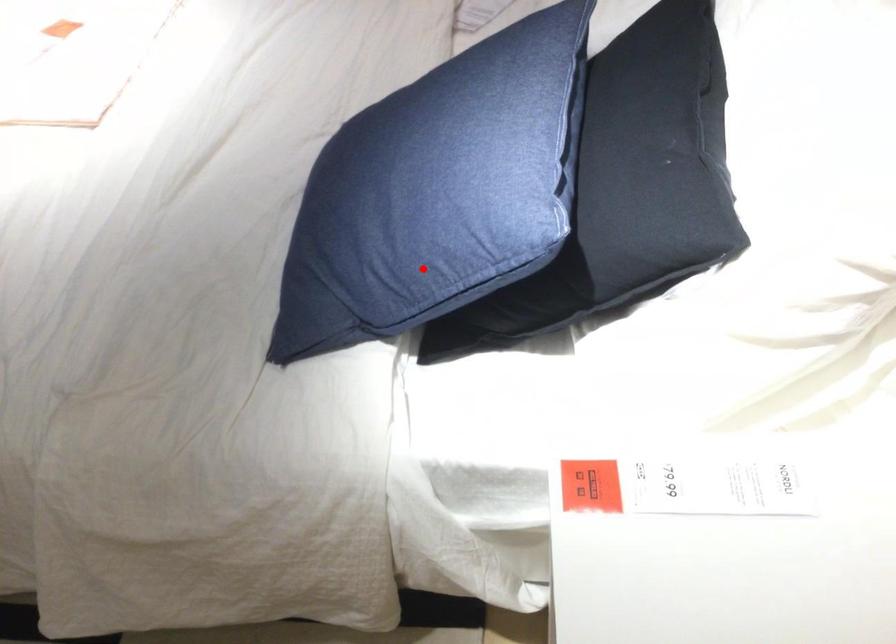
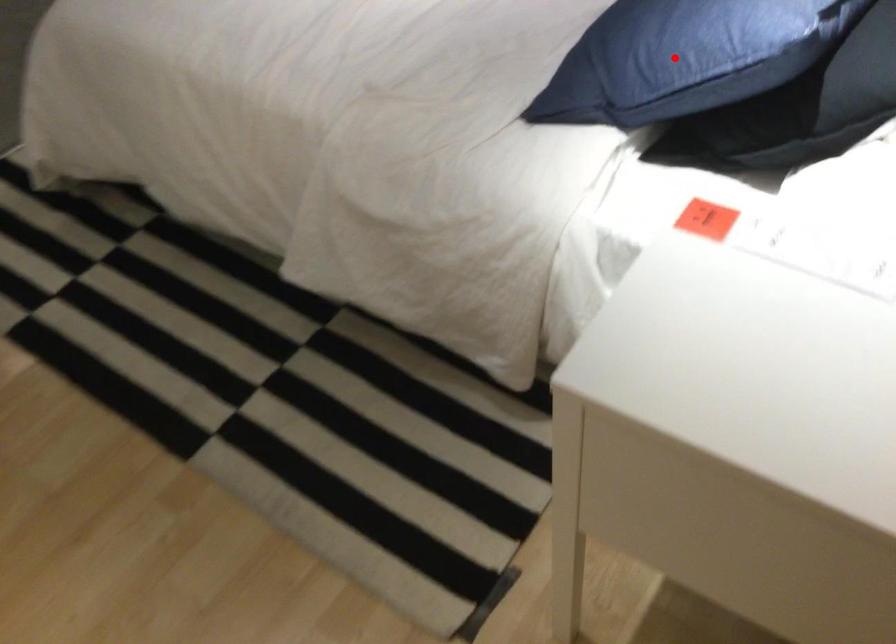
I am providing you with two images of the same scene from different viewpoints. A red point is marked on the first image and another point is marked on the second image. Does the point marked in image1 correspond to the same location as the one in image2?

Yes